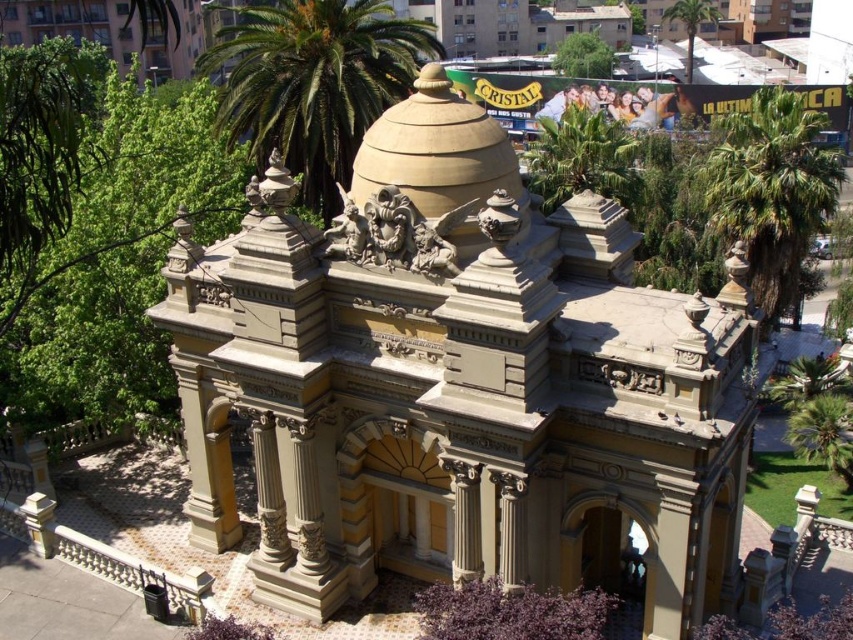
You are standing in front of the monument and want to take a photo that includes both the green leafy palm at center and the green leafy palm tree at right. Which palm should be placed on the left side of your photo?

The green leafy palm at center should be placed on the left side of your photo because it is positioned to the left of the green leafy palm tree at right.

You are a drone operator who needs to fly a drone from the green leafy palm tree at right to the green leafy palm tree at upper center. The maximum flight distance of your drone is 50 meters. Can the drone complete this flight without needing a battery recharge?

The distance between the green leafy palm tree at right and the green leafy palm tree at upper center is 52.31 meters, which exceeds the drone maximum flight distance of 50 meters. The drone cannot complete this flight without needing a battery recharge.